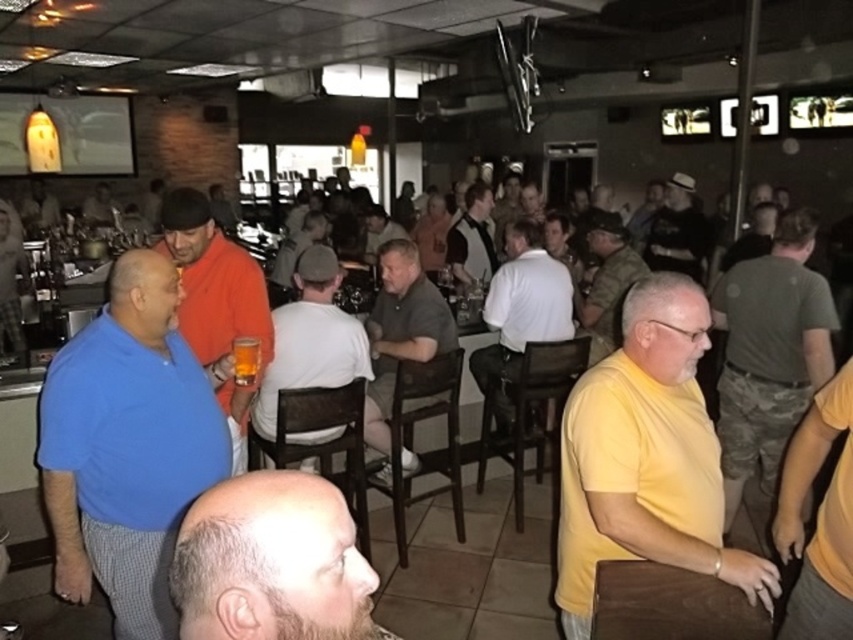
You are a photographer trying to capture a candid shot of the orange matte shirt at center and the dark gray hat at upper right. Since you want to ensure both subjects are in focus, you need to know their heights relative to each other. Which of the two is shorter?

The orange matte shirt at center has a lesser height compared to dark gray hat at upper right, so the orange matte shirt at center is shorter.

You are standing at the entrance of the bar and want to locate the person wearing the orange matte shirt at center. Which direction should you look to find them?

The orange matte shirt at center is located at point (x=216, y=300), so you should look towards the center of the image to find them.

You are a photographer at this event and want to capture both the yellow matte shirt at right and the dark gray hat at upper right in a single frame. Which object should you zoom in on more to ensure both are clearly visible?

The yellow matte shirt at right is smaller than the dark gray hat at upper right, so you should zoom in more on the yellow matte shirt at right to ensure both are clearly visible.